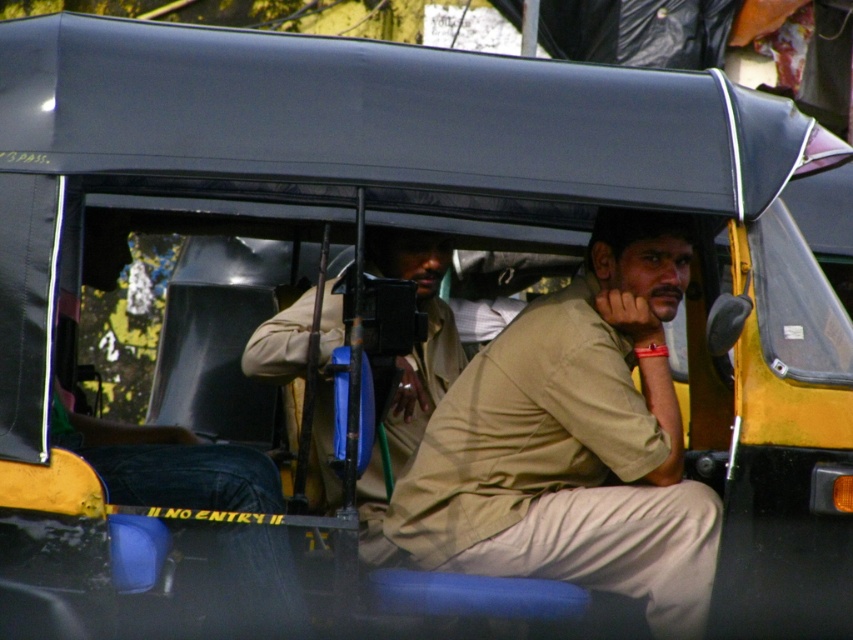
Which is above, beige cotton shirt at center or khaki uniform at center?

Positioned higher is khaki uniform at center.

Describe the element at coordinates (573, 442) in the screenshot. I see `beige cotton shirt at center` at that location.

At what (x,y) coordinates should I click in order to perform the action: click on beige cotton shirt at center. Please return your answer as a coordinate pair (x, y). Image resolution: width=853 pixels, height=640 pixels. Looking at the image, I should click on (573, 442).